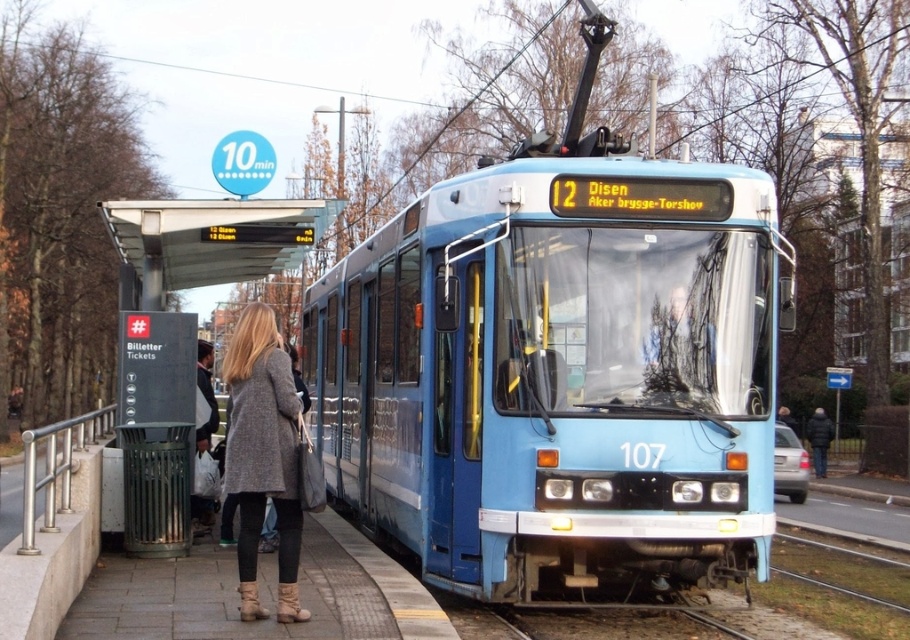
Does blue metallic train at center have a lesser height compared to gray wool coat at center?

Indeed, blue metallic train at center has a lesser height compared to gray wool coat at center.

Which is in front, point (583, 344) or point (279, 499)?

Positioned in front is point (279, 499).

Locate an element on the screen. blue metallic train at center is located at coordinates (559, 374).

Is point (271, 387) behind point (130, 232)?

No, (271, 387) is closer to viewer.

Which is above, gray wool coat at center or metallic gray ticket machine at lower left?

metallic gray ticket machine at lower left is above.

The image size is (910, 640). I want to click on gray wool coat at center, so click(263, 456).

At what (x,y) coordinates should I click in order to perform the action: click on gray wool coat at center. Please return your answer as a coordinate pair (x, y). The image size is (910, 640). Looking at the image, I should click on (263, 456).

Looking at this image, can you confirm if blue metallic train at center is bigger than white plastic bag at center?

No, blue metallic train at center is not bigger than white plastic bag at center.

Does blue metallic train at center have a lesser width compared to white plastic bag at center?

Correct, blue metallic train at center's width is less than white plastic bag at center's.

Where is `blue metallic train at center`? This screenshot has width=910, height=640. blue metallic train at center is located at coordinates (559, 374).

You are a GUI agent. You are given a task and a screenshot of the screen. Output one action in this format:
    pyautogui.click(x=<x>, y=<y>)
    Task: Click on the blue metallic train at center
    This screenshot has width=910, height=640.
    Given the screenshot: What is the action you would take?
    pyautogui.click(x=559, y=374)